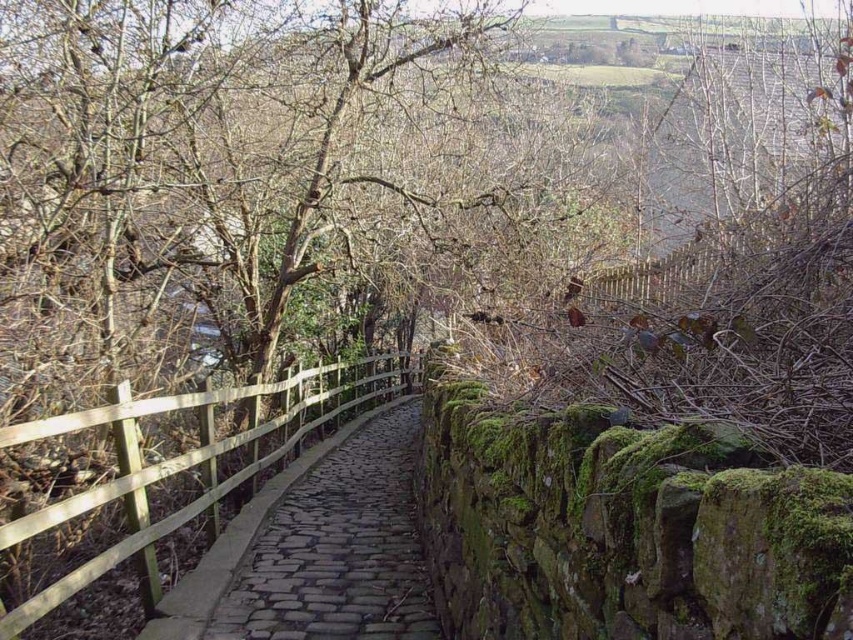
Who is positioned more to the right, cobblestone path at center or wooden fence at center?

cobblestone path at center

What do you see at coordinates (337, 548) in the screenshot? This screenshot has width=853, height=640. I see `cobblestone path at center` at bounding box center [337, 548].

Does point (366, 612) come behind point (251, 477)?

That is False.

The height and width of the screenshot is (640, 853). What are the coordinates of `cobblestone path at center` in the screenshot? It's located at (337, 548).